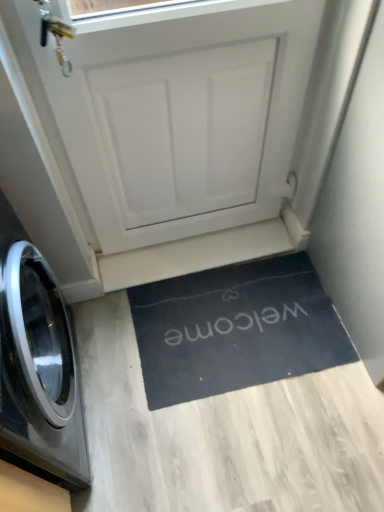
Question: Considering the relative positions of black rubber doormat at lower center and black glossy washing machine at left in the image provided, is black rubber doormat at lower center to the left of black glossy washing machine at left from the viewer's perspective?

Choices:
 (A) no
 (B) yes

Answer: (A)

Question: Is black rubber doormat at lower center wider than black glossy washing machine at left?

Choices:
 (A) no
 (B) yes

Answer: (B)

Question: Does black rubber doormat at lower center have a lesser width compared to black glossy washing machine at left?

Choices:
 (A) yes
 (B) no

Answer: (B)

Question: From a real-world perspective, is black rubber doormat at lower center below black glossy washing machine at left?

Choices:
 (A) no
 (B) yes

Answer: (B)

Question: Does black rubber doormat at lower center lie behind black glossy washing machine at left?

Choices:
 (A) no
 (B) yes

Answer: (B)

Question: Considering their positions, is black rubber doormat at lower center located in front of or behind black glossy washing machine at left?

Choices:
 (A) behind
 (B) front

Answer: (A)

Question: Is black rubber doormat at lower center to the left or to the right of black glossy washing machine at left in the image?

Choices:
 (A) right
 (B) left

Answer: (A)

Question: From their relative heights in the image, would you say black rubber doormat at lower center is taller or shorter than black glossy washing machine at left?

Choices:
 (A) short
 (B) tall

Answer: (A)

Question: Do you think black rubber doormat at lower center is within black glossy washing machine at left, or outside of it?

Choices:
 (A) outside
 (B) inside

Answer: (A)

Question: From the image's perspective, relative to white matte door at center, is black glossy washing machine at left above or below?

Choices:
 (A) below
 (B) above

Answer: (A)

Question: Considering the positions of black glossy washing machine at left and white matte door at center in the image, is black glossy washing machine at left taller or shorter than white matte door at center?

Choices:
 (A) tall
 (B) short

Answer: (B)

Question: In the image, is black glossy washing machine at left on the left side or the right side of white matte door at center?

Choices:
 (A) right
 (B) left

Answer: (B)

Question: Which is correct: black glossy washing machine at left is inside white matte door at center, or outside of it?

Choices:
 (A) outside
 (B) inside

Answer: (A)

Question: Considering the positions of white matte door at center and black glossy washing machine at left in the image, is white matte door at center taller or shorter than black glossy washing machine at left?

Choices:
 (A) short
 (B) tall

Answer: (B)

Question: Based on their positions, is white matte door at center located to the left or right of black glossy washing machine at left?

Choices:
 (A) left
 (B) right

Answer: (B)